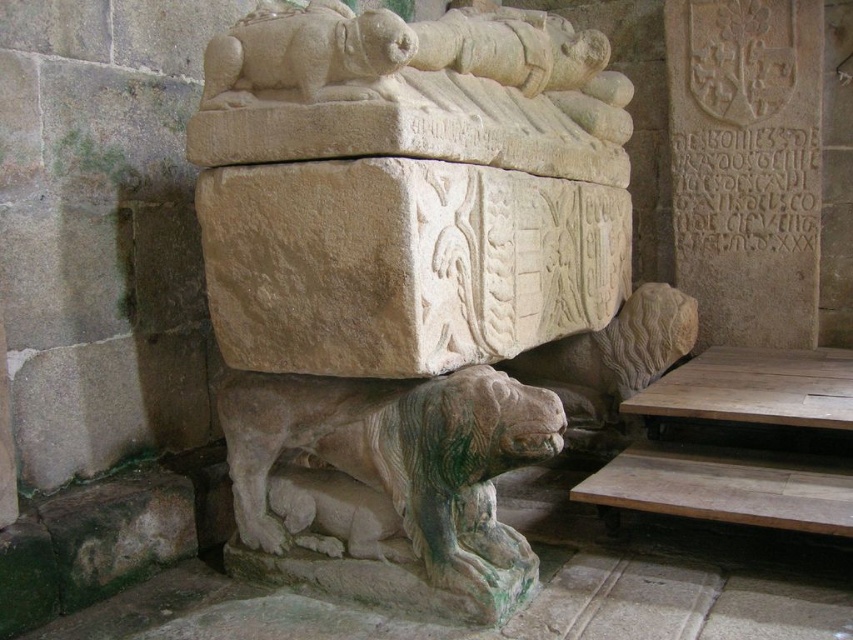
Question: Is stone lion statue at center smaller than green stone lion at lower left?

Choices:
 (A) yes
 (B) no

Answer: (B)

Question: From the image, what is the correct spatial relationship of stone lion statue at center in relation to green stone lion at lower left?

Choices:
 (A) left
 (B) right

Answer: (B)

Question: Considering the real-world distances, which object is closest to the green stone lion at lower left?

Choices:
 (A) stone lion statue at center
 (B) stone lion at upper center

Answer: (A)

Question: Is green stone lion at lower left smaller than stone lion at upper center?

Choices:
 (A) no
 (B) yes

Answer: (A)

Question: Which point is closer to the camera taking this photo?

Choices:
 (A) (245, 38)
 (B) (227, 109)

Answer: (A)

Question: Which of the following is the closest to the observer?

Choices:
 (A) (647, 349)
 (B) (372, 33)

Answer: (B)